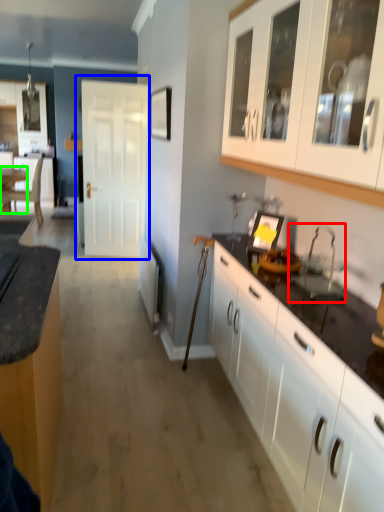
Question: Considering the real-world distances, which object is closest to sink (highlighted by a red box)? door (highlighted by a blue box) or table (highlighted by a green box).

Choices:
 (A) door
 (B) table

Answer: (A)